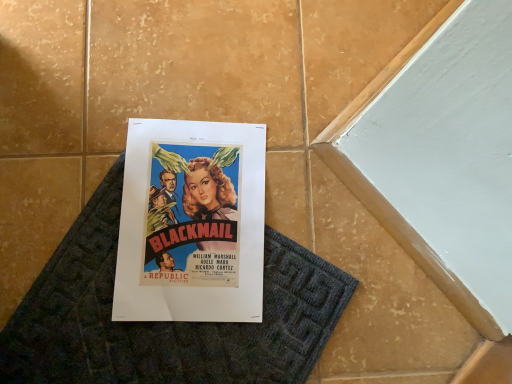
What are the coordinates of `free space above matte paper poster at center (from a real-world perspective)` in the screenshot? It's located at (195, 213).